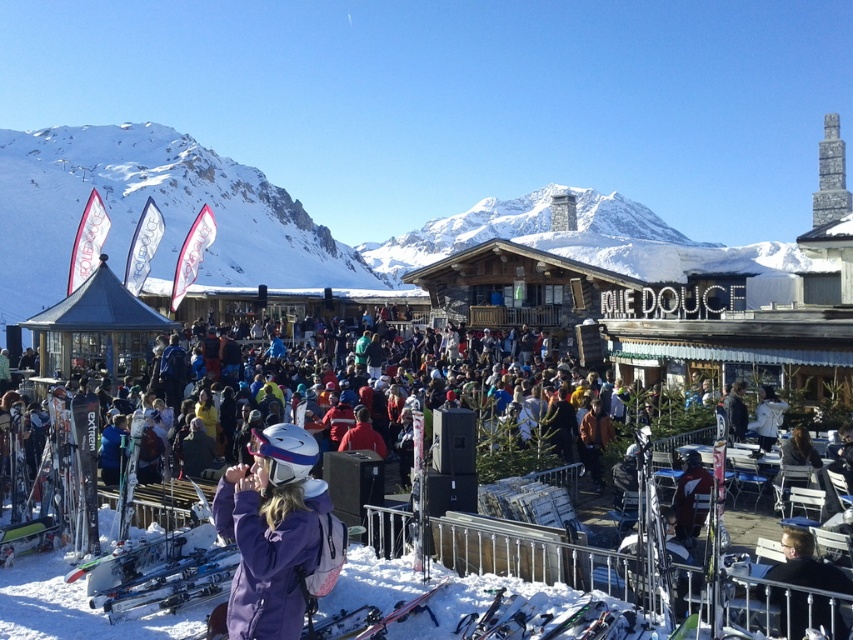
You are a photographer trying to capture both the purple matte jacket at center and the light brown leather jacket at lower right in a single frame. Based on their positions and sizes, do you think you can fit both into your camera view without moving closer or farther away?

The purple matte jacket at center might be wider than light brown leather jacket at lower right, so there is a possibility that the purple matte jacket at center could take up more space in the frame. However, since the exact width difference isn not specified, it depends on how much wider the purple matte jacket at center is compared to the light brown leather jacket at lower right. If the width difference is minimal, both might fit, but if it is significant, adjusting the camera angle slightly might be ne